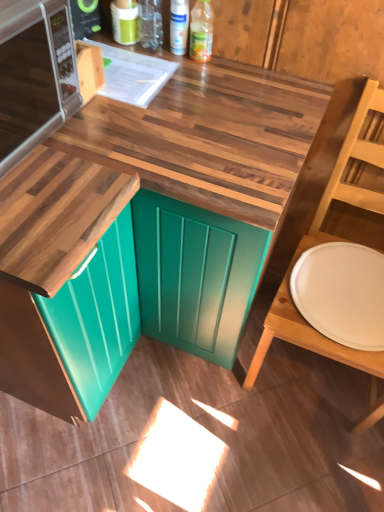
Find the location of a particular element. free space to the right of silver metallic microwave at upper left is located at coordinates (115, 142).